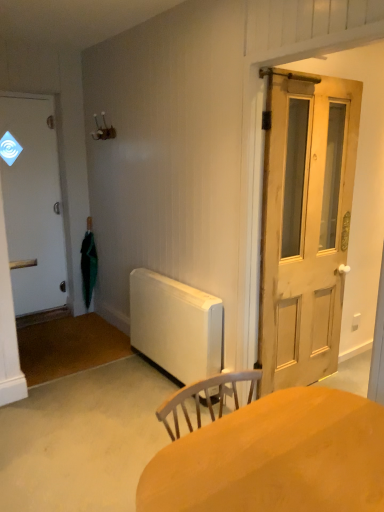
Describe the element at coordinates (88, 264) in the screenshot. I see `green matte umbrella at left` at that location.

Find the location of a particular element. smooth wooden desk at center is located at coordinates (275, 458).

Find the location of a particular element. green matte umbrella at left is located at coordinates (88, 264).

Is white matte radiator at center aimed at natural wood door at right, which is the 1th door in right-to-left order?

No.

Who is more distant, white matte radiator at center or natural wood door at right, placed as the first door when sorted from front to back?

white matte radiator at center is further from the camera.

Which is more to the right, white matte radiator at center or natural wood door at right, which appears as the second door when viewed from the back?

Positioned to the right is natural wood door at right, which appears as the second door when viewed from the back.

Is white matte radiator at center in contact with natural wood door at right, which is counted as the 2th door, starting from the left?

No, white matte radiator at center is not making contact with natural wood door at right, which is counted as the 2th door, starting from the left.

Does white matte door at left, the first door positioned from the left, appear on the right side of white matte radiator at center?

Incorrect, white matte door at left, the first door positioned from the left, is not on the right side of white matte radiator at center.

Is white matte door at left, the first door positioned from the left, positioned far away from white matte radiator at center?

Yes, white matte door at left, the first door positioned from the left, and white matte radiator at center are located far from each other.

Is white matte door at left, the second door in the right-to-left sequence, completely or partially outside of white matte radiator at center?

Yes, white matte door at left, the second door in the right-to-left sequence, is located beyond the bounds of white matte radiator at center.

Considering the relative sizes of white matte radiator at center and white matte door at left, the first door positioned from the left, in the image provided, is white matte radiator at center bigger than white matte door at left, the first door positioned from the left,?

No, white matte radiator at center is not bigger than white matte door at left, the first door positioned from the left.

From a real-world perspective, between white matte radiator at center and white matte door at left, the second door in the right-to-left sequence, who is vertically lower?

In real-world perspective, white matte radiator at center is lower.

Does white matte radiator at center contain white matte door at left, the 1th door when ordered from back to front?

No, white matte door at left, the 1th door when ordered from back to front, is not a part of white matte radiator at center.

From a real-world perspective, is natural wood door at right, which is counted as the 2th door, starting from the left, located higher than green matte umbrella at left?

Yes, from a real-world perspective, natural wood door at right, which is counted as the 2th door, starting from the left, is on top of green matte umbrella at left.

Considering the sizes of natural wood door at right, which is counted as the 2th door, starting from the left, and green matte umbrella at left in the image, is natural wood door at right, which is counted as the 2th door, starting from the left, wider or thinner than green matte umbrella at left?

Clearly, natural wood door at right, which is counted as the 2th door, starting from the left, has less width compared to green matte umbrella at left.

Do you think natural wood door at right, placed as the first door when sorted from front to back, is within green matte umbrella at left, or outside of it?

natural wood door at right, placed as the first door when sorted from front to back, is located beyond the bounds of green matte umbrella at left.

Is natural wood door at right, which is counted as the 2th door, starting from the left, at the left side of green matte umbrella at left?

No.

Does point (352, 176) lie behind point (196, 349)?

Yes, point (352, 176) is farther from viewer.

Does natural wood door at right, which is the 1th door in right-to-left order, have a greater width compared to white matte radiator at center?

No, natural wood door at right, which is the 1th door in right-to-left order, is not wider than white matte radiator at center.

Which is more to the right, natural wood door at right, which is counted as the 2th door, starting from the left, or white matte radiator at center?

From the viewer's perspective, natural wood door at right, which is counted as the 2th door, starting from the left, appears more on the right side.

Considering the sizes of objects natural wood door at right, placed as the first door when sorted from front to back, and white matte radiator at center in the image provided, who is bigger, natural wood door at right, placed as the first door when sorted from front to back, or white matte radiator at center?

natural wood door at right, placed as the first door when sorted from front to back, is bigger.

Is point (173, 321) more distant than point (89, 285)?

No, it is in front of (89, 285).

Is the position of white matte radiator at center more distant than that of green matte umbrella at left?

No, the depth of white matte radiator at center is less than that of green matte umbrella at left.

Based on the photo, can you tell me how much white matte radiator at center and green matte umbrella at left differ in facing direction?

They differ by 59.5 degrees in their facing directions.

Is natural wood door at right, which appears as the second door when viewed from the back, facing towards smooth wooden desk at center?

No, natural wood door at right, which appears as the second door when viewed from the back, is not turned towards smooth wooden desk at center.

Where is `the 1st door above the smooth wooden desk at center (from the image's perspective)`? the 1st door above the smooth wooden desk at center (from the image's perspective) is located at coordinates (305, 223).

What's the angular difference between natural wood door at right, which is counted as the 2th door, starting from the left, and smooth wooden desk at center's facing directions?

The angular difference between natural wood door at right, which is counted as the 2th door, starting from the left, and smooth wooden desk at center is 1.3 degrees.

Does natural wood door at right, placed as the first door when sorted from front to back, have a smaller size compared to smooth wooden desk at center?

Correct, natural wood door at right, placed as the first door when sorted from front to back, occupies less space than smooth wooden desk at center.

Image resolution: width=384 pixels, height=512 pixels. Find the location of `radiator on the left of natural wood door at right, placed as the first door when sorted from front to back`. radiator on the left of natural wood door at right, placed as the first door when sorted from front to back is located at coordinates (176, 326).

This screenshot has width=384, height=512. Find the location of `door that is the 2nd one above the white matte radiator at center (from a real-world perspective)`. door that is the 2nd one above the white matte radiator at center (from a real-world perspective) is located at coordinates (33, 205).

Which object lies nearer to the anchor point smooth wooden desk at center, white matte door at left, the second door in the right-to-left sequence, or natural wood door at right, which appears as the second door when viewed from the back?

Based on the image, natural wood door at right, which appears as the second door when viewed from the back, appears to be nearer to smooth wooden desk at center.

Which object lies nearer to the anchor point natural wood door at right, which is counted as the 2th door, starting from the left, green matte umbrella at left or smooth wooden desk at center?

smooth wooden desk at center lies closer to natural wood door at right, which is counted as the 2th door, starting from the left, than the other object.

When comparing their distances from green matte umbrella at left, does smooth wooden desk at center or white matte radiator at center seem further?

smooth wooden desk at center.

When comparing their distances from white matte door at left, the 1th door when ordered from back to front, does white matte radiator at center or green matte umbrella at left seem further?

Based on the image, white matte radiator at center appears to be further to white matte door at left, the 1th door when ordered from back to front.

From the image, which object appears to be nearer to smooth wooden desk at center, white matte radiator at center or white matte door at left, the first door positioned from the left?

white matte radiator at center lies closer to smooth wooden desk at center than the other object.

Based on the photo, from the image, which object appears to be farther from natural wood door at right, which appears as the second door when viewed from the back, white matte radiator at center or green matte umbrella at left?

Among the two, green matte umbrella at left is located further to natural wood door at right, which appears as the second door when viewed from the back.

From the image, which object appears to be nearer to white matte door at left, the 1th door when ordered from back to front, green matte umbrella at left or smooth wooden desk at center?

green matte umbrella at left is closer to white matte door at left, the 1th door when ordered from back to front.

Considering their positions, is white matte door at left, the 2th door positioned from the front, positioned closer to natural wood door at right, placed as the first door when sorted from front to back, than white matte radiator at center?

white matte radiator at center.

You are a GUI agent. You are given a task and a screenshot of the screen. Output one action in this format:
    pyautogui.click(x=<x>, y=<y>)
    Task: Click on the radiator positioned between natural wood door at right, which is the 1th door in right-to-left order, and green matte umbrella at left from near to far
    The height and width of the screenshot is (512, 384).
    Given the screenshot: What is the action you would take?
    pyautogui.click(x=176, y=326)

Where is `door located between smooth wooden desk at center and white matte radiator at center in the depth direction`? The image size is (384, 512). door located between smooth wooden desk at center and white matte radiator at center in the depth direction is located at coordinates (305, 223).

This screenshot has width=384, height=512. Identify the location of radiator located between white matte door at left, the second door in the right-to-left sequence, and natural wood door at right, which is counted as the 2th door, starting from the left, in the left-right direction. (176, 326).

Image resolution: width=384 pixels, height=512 pixels. What are the coordinates of `door between smooth wooden desk at center and white matte door at left, the first door positioned from the left, from front to back` in the screenshot? It's located at (305, 223).